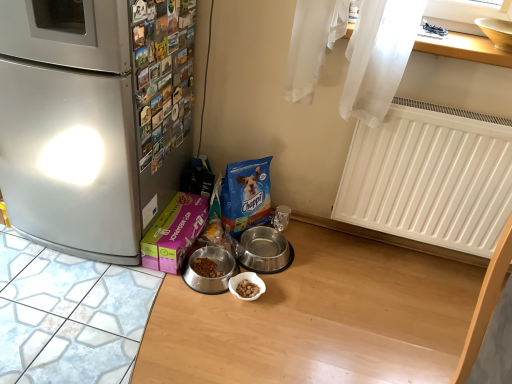
Question: In terms of height, does brushed metal refrigerator at left look taller or shorter compared to yellow ceramic bowl at upper right, the first appliance in the top-to-bottom sequence?

Choices:
 (A) tall
 (B) short

Answer: (A)

Question: Considering the positions of brushed metal refrigerator at left and yellow ceramic bowl at upper right, acting as the 3th appliance starting from the bottom, in the image, is brushed metal refrigerator at left wider or thinner than yellow ceramic bowl at upper right, acting as the 3th appliance starting from the bottom,?

Choices:
 (A) thin
 (B) wide

Answer: (B)

Question: Which object is positioned closest to the silver metallic bowl at lower center, which appears as the second appliance when viewed from the top?

Choices:
 (A) yellow ceramic bowl at upper right, which ranks as the 1th appliance in right-to-left order
 (B) wooden at upper right
 (C) pink matte box at lower left
 (D) white plastic radiator at right
 (E) metallic stainless steel bowl at center, which appears as the first appliance when ordered from the bottom

Answer: (E)

Question: Considering the real-world distances, which object is farthest from the wooden at upper right?

Choices:
 (A) metallic stainless steel bowl at center, which appears as the first appliance when ordered from the bottom
 (B) yellow ceramic bowl at upper right, which is the third appliance from left to right
 (C) pink matte box at lower left
 (D) white plastic radiator at right
 (E) brushed metal refrigerator at left

Answer: (A)